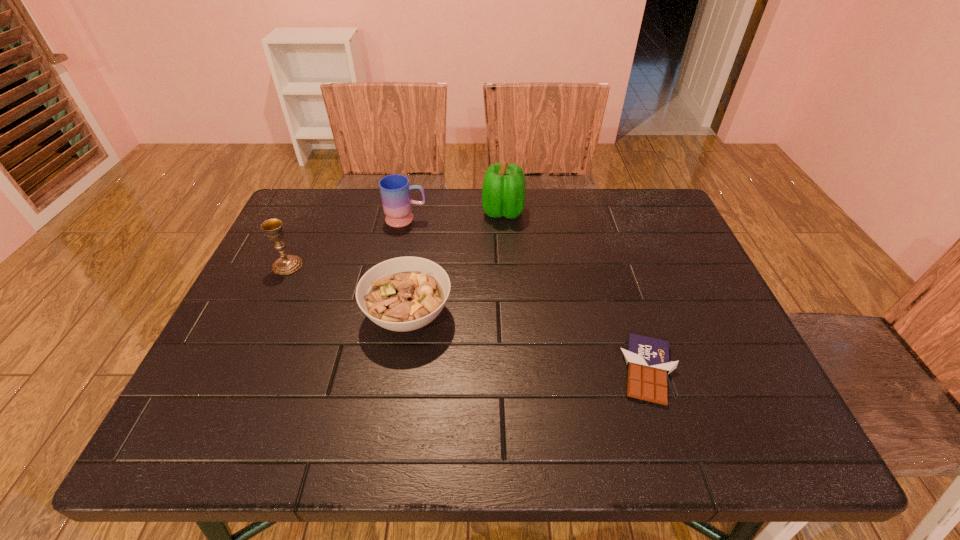
Identify the location of the fourth object from left to right. (503, 193).

Identify the location of bell pepper. (503, 193).

Where is `the leftmost object`? The image size is (960, 540). the leftmost object is located at coordinates (287, 264).

At what (x,y) coordinates should I click in order to perform the action: click on the third farthest object. Please return your answer as a coordinate pair (x, y). The width and height of the screenshot is (960, 540). Looking at the image, I should click on (287, 264).

What are the coordinates of `mug` in the screenshot? It's located at (395, 189).

Identify the location of stew. The width and height of the screenshot is (960, 540). (401, 294).

Image resolution: width=960 pixels, height=540 pixels. What are the coordinates of `the shortest object` in the screenshot? It's located at (647, 358).

This screenshot has height=540, width=960. Find the location of `the rightmost object`. the rightmost object is located at coordinates [647, 358].

Identify the location of free space located on the front of the bell pepper. (x=507, y=278).

Identify the location of vacant area located 0.150m on the right of the third farthest object. click(x=359, y=266).